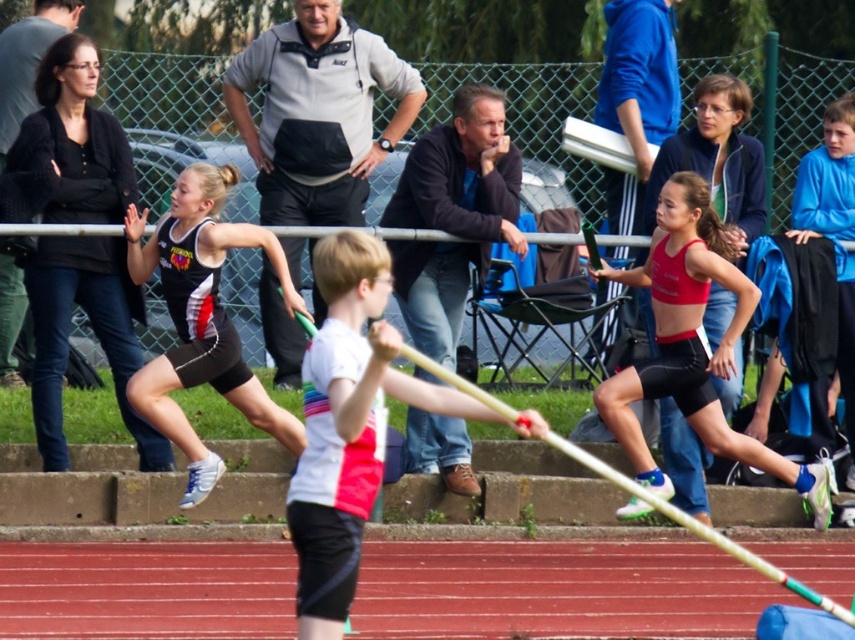
From the picture: You are a photographer positioned at the starting line of the pole vault runway. You want to take a photo of the athlete wearing the matte red crop top at center and the athlete in black matte shorts at left. Which athlete will appear closer to the camera in the photo?

The matte red crop top at center will appear closer to the camera because it is further to the viewer than the black matte shorts at left, meaning it is positioned nearer to the photographer.